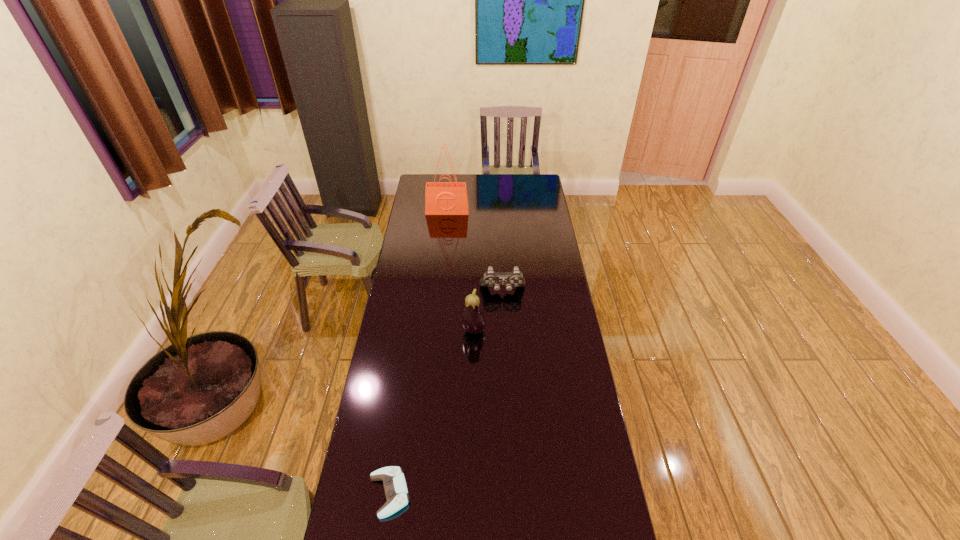
In order to click on vacant space located 0.130m on the surface of the right control with buttons in this screenshot , I will do `click(504, 319)`.

At what (x,y) coordinates should I click in order to perform the action: click on vacant area located on the right of the shorter control. Please return your answer as a coordinate pair (x, y). The width and height of the screenshot is (960, 540). Looking at the image, I should click on (515, 494).

Identify the location of tote bag that is positioned at the left edge. (441, 198).

Locate an element on the screen. Image resolution: width=960 pixels, height=540 pixels. control present at the left edge is located at coordinates (395, 487).

Find the location of `vacant space at the left edge`. vacant space at the left edge is located at coordinates (424, 288).

The image size is (960, 540). Find the location of `free space at the right edge of the desktop`. free space at the right edge of the desktop is located at coordinates (557, 247).

Locate an element on the screen. This screenshot has width=960, height=540. free space at the far left corner of the desktop is located at coordinates (432, 175).

Locate an element on the screen. vacant region at the far right corner of the desktop is located at coordinates (531, 183).

Locate an element on the screen. This screenshot has height=540, width=960. unoccupied area between the second shortest object and the tallest object is located at coordinates (475, 251).

Where is `vacant area that lies between the left control and the second farthest object`? The image size is (960, 540). vacant area that lies between the left control and the second farthest object is located at coordinates (446, 392).